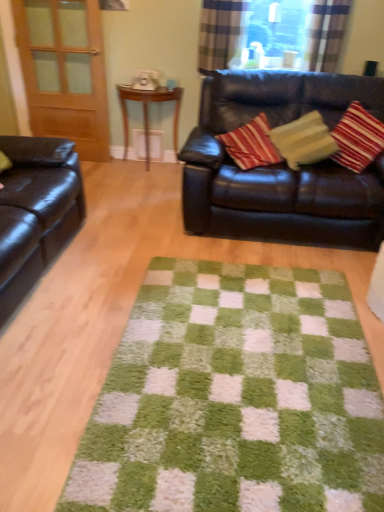
Question: Does plaid fabric curtain at upper center, the 1th curtain when ordered from right to left, contain plaid fabric curtain at upper right, the 2th curtain from the right?

Choices:
 (A) yes
 (B) no

Answer: (B)

Question: Does plaid fabric curtain at upper center, the 1th curtain when ordered from right to left, have a lesser height compared to plaid fabric curtain at upper right, which appears as the 1th curtain when viewed from the left?

Choices:
 (A) yes
 (B) no

Answer: (A)

Question: From the image's perspective, would you say plaid fabric curtain at upper center, the second curtain in the left-to-right sequence, is shown under plaid fabric curtain at upper right, the 2th curtain from the right?

Choices:
 (A) yes
 (B) no

Answer: (A)

Question: Is the surface of plaid fabric curtain at upper center, the second curtain in the left-to-right sequence, in direct contact with plaid fabric curtain at upper right, which appears as the 1th curtain when viewed from the left?

Choices:
 (A) yes
 (B) no

Answer: (B)

Question: Considering the relative sizes of plaid fabric curtain at upper center, the 1th curtain when ordered from right to left, and plaid fabric curtain at upper right, which appears as the 1th curtain when viewed from the left, in the image provided, is plaid fabric curtain at upper center, the 1th curtain when ordered from right to left, thinner than plaid fabric curtain at upper right, which appears as the 1th curtain when viewed from the left,?

Choices:
 (A) yes
 (B) no

Answer: (B)

Question: From a real-world perspective, relative to plaid fabric curtain at upper right, the 2th curtain from the right, is matte wood screen door at left vertically above or below?

Choices:
 (A) above
 (B) below

Answer: (B)

Question: Visually, is matte wood screen door at left positioned to the left or to the right of plaid fabric curtain at upper right, which appears as the 1th curtain when viewed from the left?

Choices:
 (A) right
 (B) left

Answer: (B)

Question: Which is correct: matte wood screen door at left is inside plaid fabric curtain at upper right, the 2th curtain from the right, or outside of it?

Choices:
 (A) outside
 (B) inside

Answer: (A)

Question: Does point (79, 26) appear closer or farther from the camera than point (203, 20)?

Choices:
 (A) farther
 (B) closer

Answer: (A)

Question: Looking at the image, does transparent glass window at upper center seem bigger or smaller compared to plaid fabric curtain at upper center, the 1th curtain when ordered from right to left?

Choices:
 (A) small
 (B) big

Answer: (B)

Question: Is transparent glass window at upper center situated inside plaid fabric curtain at upper center, the second curtain in the left-to-right sequence, or outside?

Choices:
 (A) inside
 (B) outside

Answer: (B)

Question: Visually, is transparent glass window at upper center positioned to the left or to the right of plaid fabric curtain at upper center, the 1th curtain when ordered from right to left?

Choices:
 (A) left
 (B) right

Answer: (A)

Question: From the image's perspective, relative to plaid fabric curtain at upper center, the second curtain in the left-to-right sequence, is transparent glass window at upper center above or below?

Choices:
 (A) below
 (B) above

Answer: (B)

Question: Based on their sizes in the image, would you say shiny black leather couch at upper right, the second studio couch in the left-to-right sequence, is bigger or smaller than transparent glass window at upper center?

Choices:
 (A) small
 (B) big

Answer: (B)

Question: Is shiny black leather couch at upper right, placed as the 1th studio couch when sorted from right to left, wider or thinner than transparent glass window at upper center?

Choices:
 (A) thin
 (B) wide

Answer: (B)